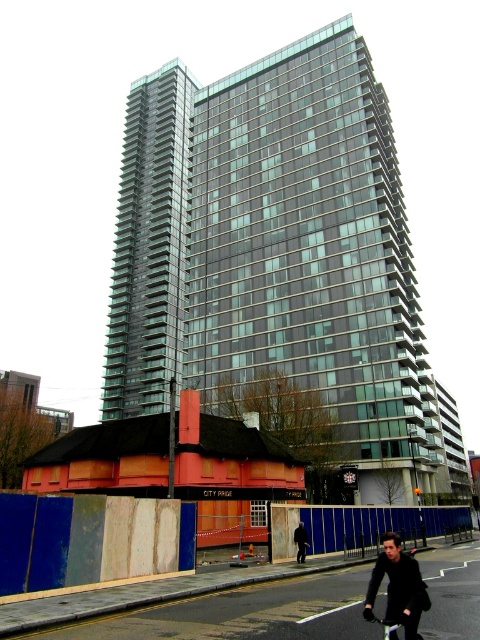
You are standing in the scene and see both the dark blue jacket at lower right and the dark brown leather jacket at lower center. Which jacket is positioned more to the right?

The dark blue jacket at lower right is positioned more to the right than the dark brown leather jacket at lower center.

You are a city planner assessing the urban layout. Given the glassy steel building at center and the black matte bicycle at lower center, which object occupies a larger horizontal space in the scene?

The glassy steel building at center has a greater width than the black matte bicycle at lower center, so it occupies a larger horizontal space in the scene.